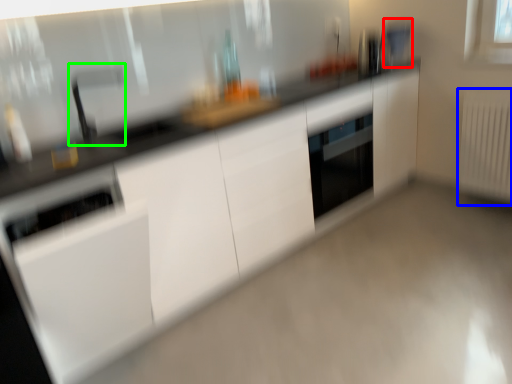
Question: Based on their relative distances, which object is farther from appliance (highlighted by a red box)? Choose from radiator (highlighted by a blue box) and faucet (highlighted by a green box).

Choices:
 (A) radiator
 (B) faucet

Answer: (B)